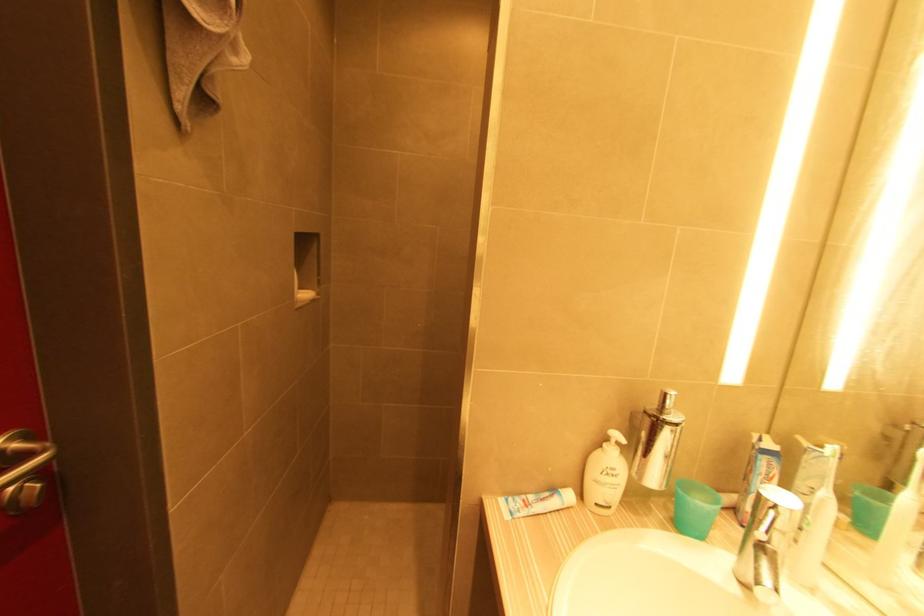
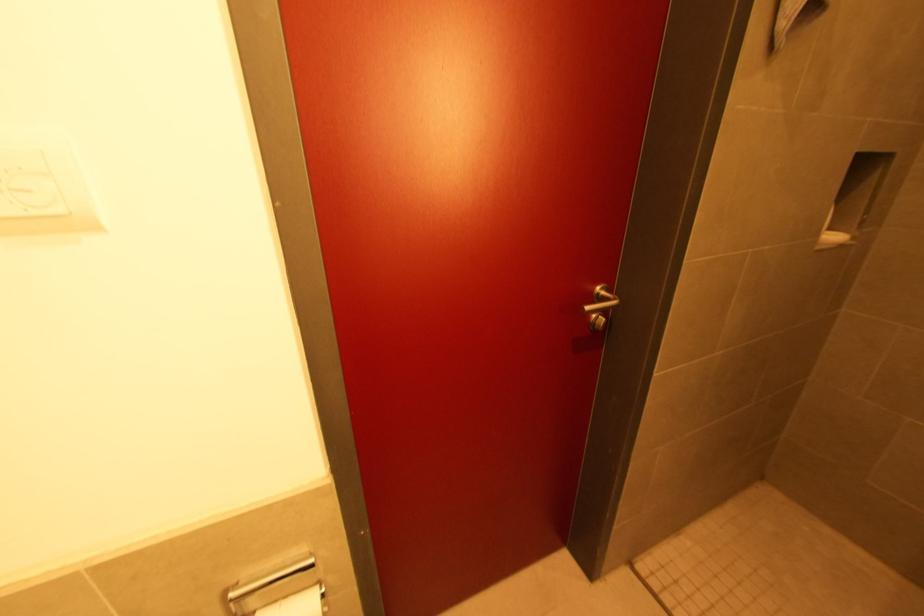
Question: How did the camera likely rotate?

Choices:
 (A) Left
 (B) Right
 (C) Up
 (D) Down

Answer: (A)